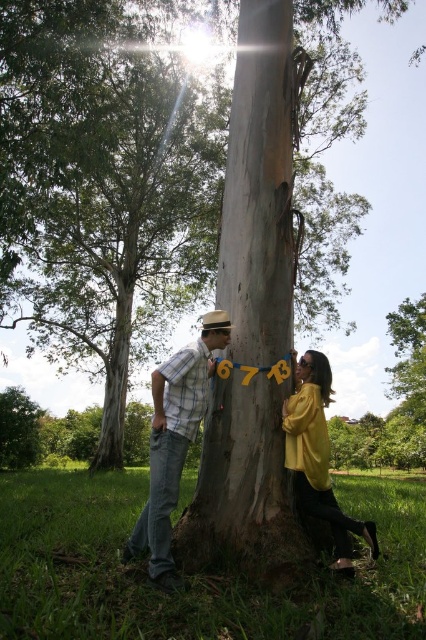
You are a photographer standing in the park and want to take a photo of both the plaid shirt at center and the yellow matte jacket at center. Can you position yourself so that both subjects are within a 5 feet range from your camera lens? Explain your reasoning.

The distance between the plaid shirt at center and the yellow matte jacket at center is 3.59 feet. Since the maximum required range is 5 feet, which is greater than 3.59 feet, you can position yourself within 5 feet of both subjects so that they are both in frame.